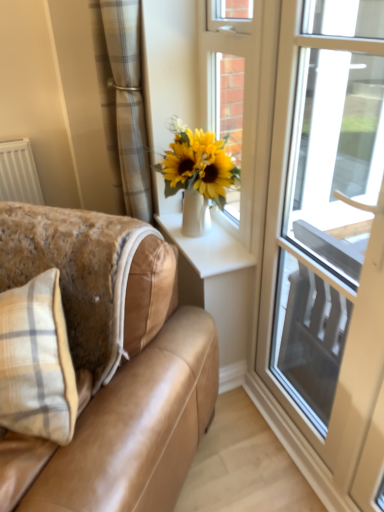
The width and height of the screenshot is (384, 512). What are the coordinates of `empty space that is ontop of white glossy vase at upper center` in the screenshot? It's located at (218, 244).